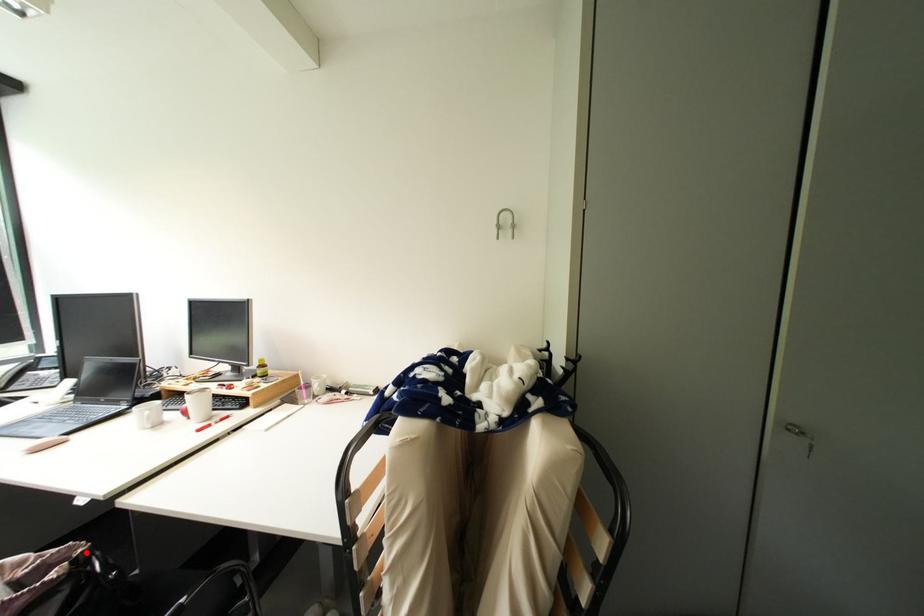
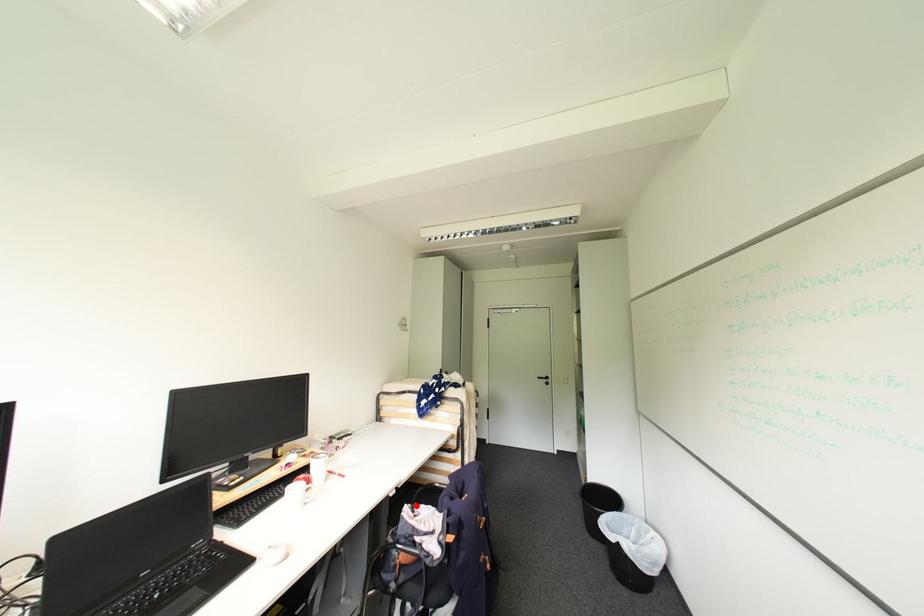
I am providing you with two images of the same scene from different viewpoints. A red point is marked on the first image and another point is marked on the second image. Do the highlighted points in image1 and image2 indicate the same real-world spot?

Yes